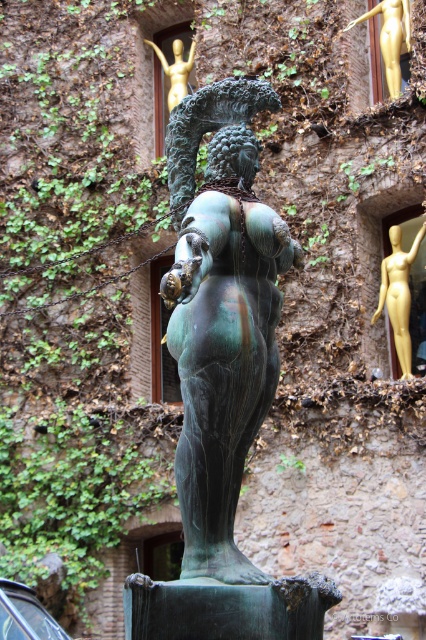
Between bronze statue at center and gold metallic statue at upper center, which one has less height?

gold metallic statue at upper center

Can you confirm if bronze statue at center is positioned below gold metallic statue at upper center?

Incorrect, bronze statue at center is not positioned below gold metallic statue at upper center.

The height and width of the screenshot is (640, 426). What do you see at coordinates (222, 378) in the screenshot?
I see `bronze statue at center` at bounding box center [222, 378].

Locate an element on the screen. The width and height of the screenshot is (426, 640). bronze statue at center is located at coordinates (222, 378).